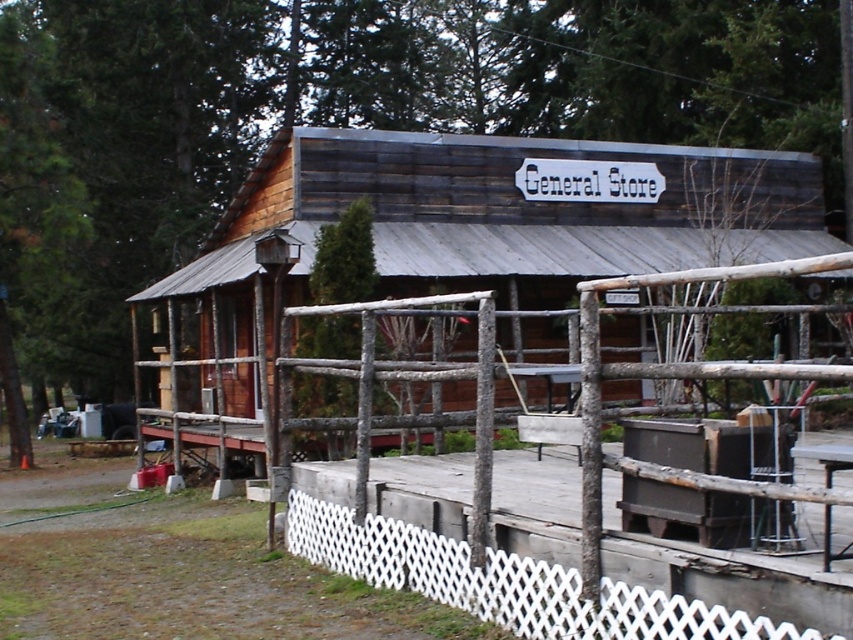
Does point (815, 186) come farther from viewer compared to point (309, 524)?

That is True.

Between weathered wood cabin at center and white lattice fence at center, which one appears on the left side from the viewer's perspective?

From the viewer's perspective, white lattice fence at center appears more on the left side.

Where is `weathered wood cabin at center`? This screenshot has height=640, width=853. weathered wood cabin at center is located at coordinates (502, 216).

I want to click on weathered wood cabin at center, so click(502, 216).

Does white lattice fence at center appear on the right side of white lattice fence at lower center?

Yes, white lattice fence at center is to the right of white lattice fence at lower center.

Is point (508, 413) farther from viewer compared to point (724, 612)?

Yes, point (508, 413) is behind point (724, 612).

Is point (698, 596) more distant than point (688, 604)?

No, (698, 596) is in front of (688, 604).

You are a GUI agent. You are given a task and a screenshot of the screen. Output one action in this format:
    pyautogui.click(x=<x>, y=<y>)
    Task: Click on the white lattice fence at center
    This screenshot has width=853, height=640.
    Given the screenshot: What is the action you would take?
    pyautogui.click(x=540, y=554)

Measure the distance between point [788,172] and camera.

The distance of point [788,172] from camera is 64.67 feet.

Can you confirm if weathered wood cabin at center is positioned to the left of white lattice fence at lower center?

Incorrect, weathered wood cabin at center is not on the left side of white lattice fence at lower center.

You are a GUI agent. You are given a task and a screenshot of the screen. Output one action in this format:
    pyautogui.click(x=<x>, y=<y>)
    Task: Click on the weathered wood cabin at center
    The height and width of the screenshot is (640, 853).
    Given the screenshot: What is the action you would take?
    pyautogui.click(x=502, y=216)

Identify the location of weathered wood cabin at center. (502, 216).